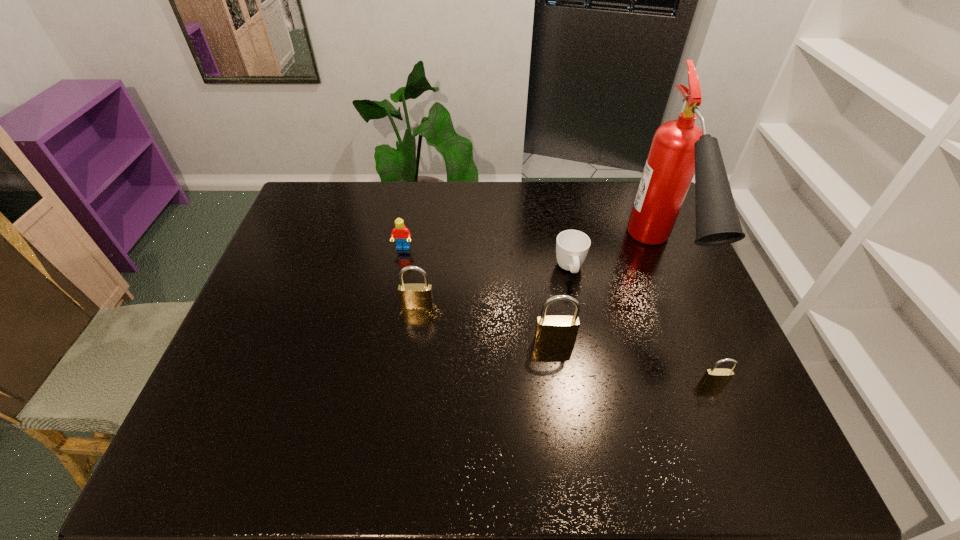
The height and width of the screenshot is (540, 960). Identify the location of free space located on the front-facing side of the second padlock from left to right. (561, 389).

You are a GUI agent. You are given a task and a screenshot of the screen. Output one action in this format:
    pyautogui.click(x=<x>, y=<y>)
    Task: Click on the vacant region located 0.070m on the front-facing side of the nearest padlock
    This screenshot has height=540, width=960.
    Given the screenshot: What is the action you would take?
    pyautogui.click(x=726, y=415)

Image resolution: width=960 pixels, height=540 pixels. In order to click on vacant space positioned 0.080m at the nozzle of the tallest object in this screenshot , I will do `click(695, 348)`.

Locate an element on the screen. The width and height of the screenshot is (960, 540). vacant space located on the face of the Lego is located at coordinates (389, 328).

The image size is (960, 540). Identify the location of vacant space situated with the handle on the side of the cup. (596, 401).

At what (x,y) coordinates should I click in order to perform the action: click on object that is at the far edge. Please return your answer as a coordinate pair (x, y). The image size is (960, 540). Looking at the image, I should click on (680, 148).

Where is `object positioned at the near edge`? object positioned at the near edge is located at coordinates 713,377.

This screenshot has height=540, width=960. I want to click on padlock that is at the right edge, so click(x=713, y=377).

Where is `fire extinguisher positioned at the right edge`? The width and height of the screenshot is (960, 540). fire extinguisher positioned at the right edge is located at coordinates [680, 148].

What are the coordinates of `object situated at the far right corner` in the screenshot? It's located at (680, 148).